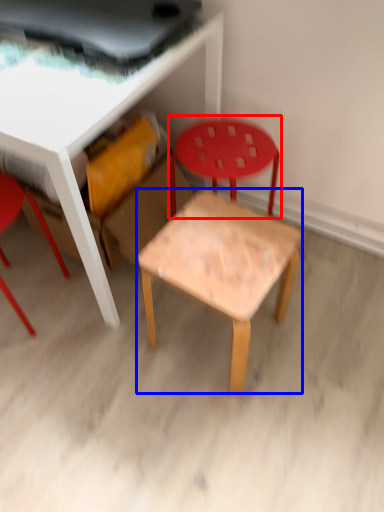
Question: Among these objects, which one is nearest to the camera, chair (highlighted by a red box) or side table (highlighted by a blue box)?

Choices:
 (A) chair
 (B) side table

Answer: (B)